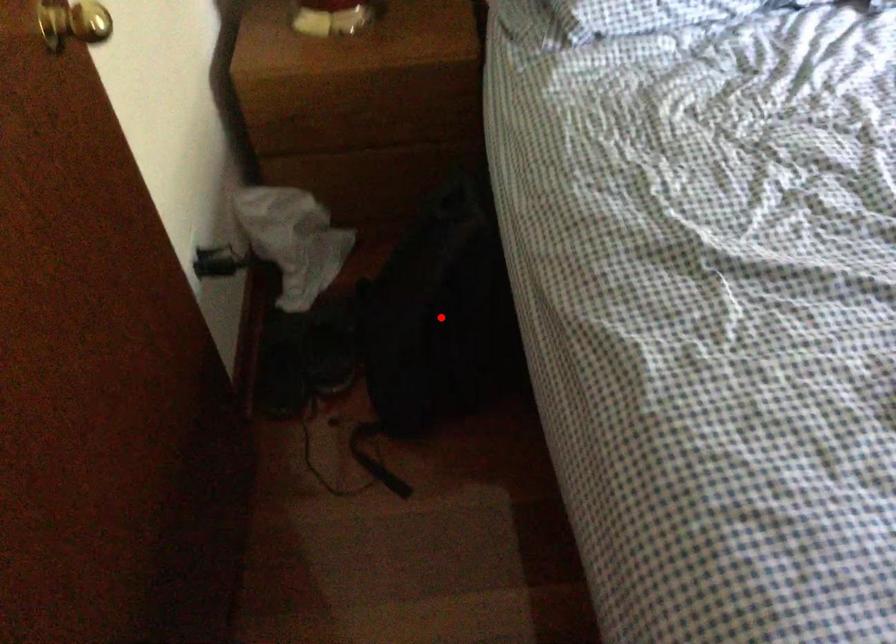
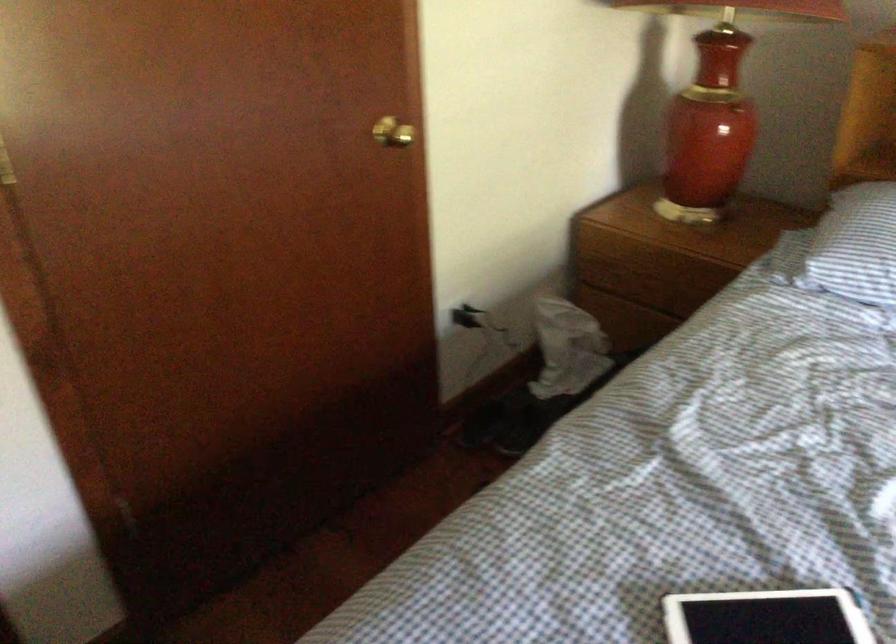
Question: I am providing you with two images of the same scene from different viewpoints. A red point is marked on the first image. Can you still see the location of the red point in image 2?

Choices:
 (A) Yes
 (B) No

Answer: (B)